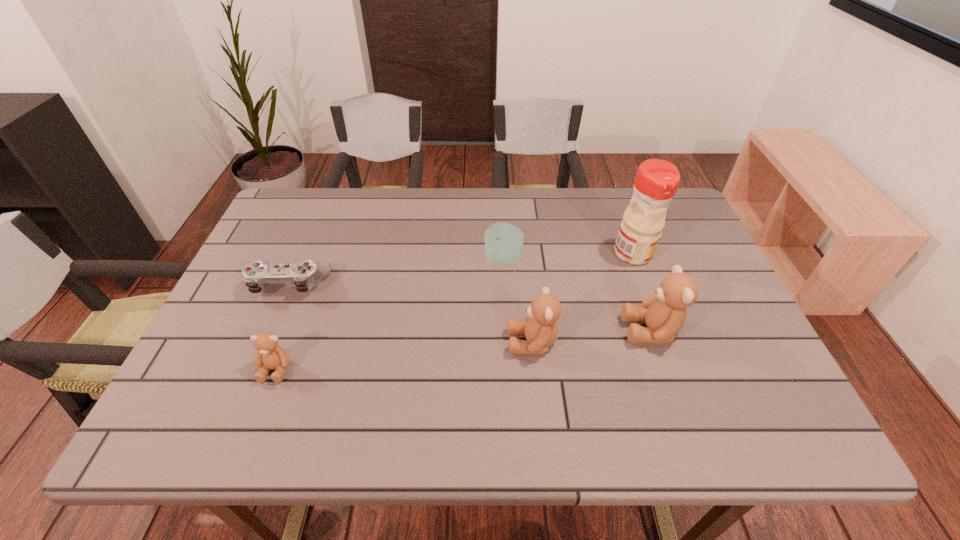
Where is `condiment that is positioned at the right edge`? Image resolution: width=960 pixels, height=540 pixels. condiment that is positioned at the right edge is located at coordinates (656, 182).

At what (x,y) coordinates should I click in order to perform the action: click on object positioned at the near left corner. Please return your answer as a coordinate pair (x, y). The image size is (960, 540). Looking at the image, I should click on (270, 355).

The width and height of the screenshot is (960, 540). In order to click on vacant space at the far edge of the desktop in this screenshot , I will do `click(539, 200)`.

Identify the location of vacant region at the near edge of the desktop. (367, 393).

The image size is (960, 540). I want to click on vacant space at the left edge of the desktop, so click(x=264, y=305).

In the image, there is a desktop. Where is `free space at the right edge`? free space at the right edge is located at coordinates (695, 244).

The image size is (960, 540). Identify the location of vacant space at the far left corner of the desktop. pos(271,222).

Image resolution: width=960 pixels, height=540 pixels. In order to click on free spot at the far right corner of the desktop in this screenshot , I will do `click(669, 234)`.

Find the location of a particular element. The height and width of the screenshot is (540, 960). empty space between the rightmost teddy bear and the shortest teddy bear is located at coordinates (464, 349).

The image size is (960, 540). What are the coordinates of `unoccupied position between the shortest teddy bear and the tallest object` in the screenshot? It's located at (454, 311).